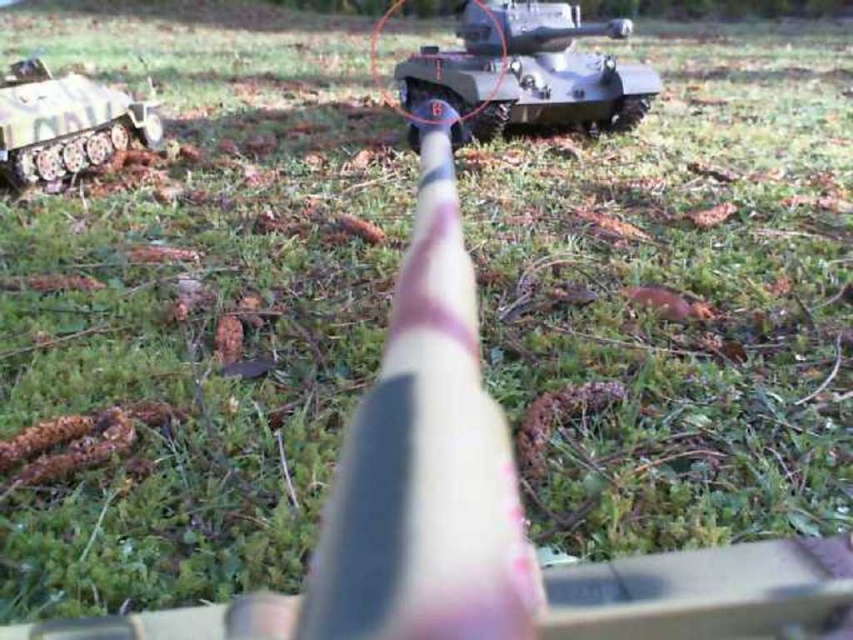
Question: Is matte gray tank at center above camouflage paint tank at left?

Choices:
 (A) no
 (B) yes

Answer: (B)

Question: Does matte gray tank at center appear on the left side of camouflage paint tank at left?

Choices:
 (A) yes
 (B) no

Answer: (B)

Question: Among these points, which one is nearest to the camera?

Choices:
 (A) (73, 161)
 (B) (608, 104)

Answer: (A)

Question: Considering the relative positions of matte gray tank at center and camouflage paint tank at left in the image provided, where is matte gray tank at center located with respect to camouflage paint tank at left?

Choices:
 (A) left
 (B) right

Answer: (B)